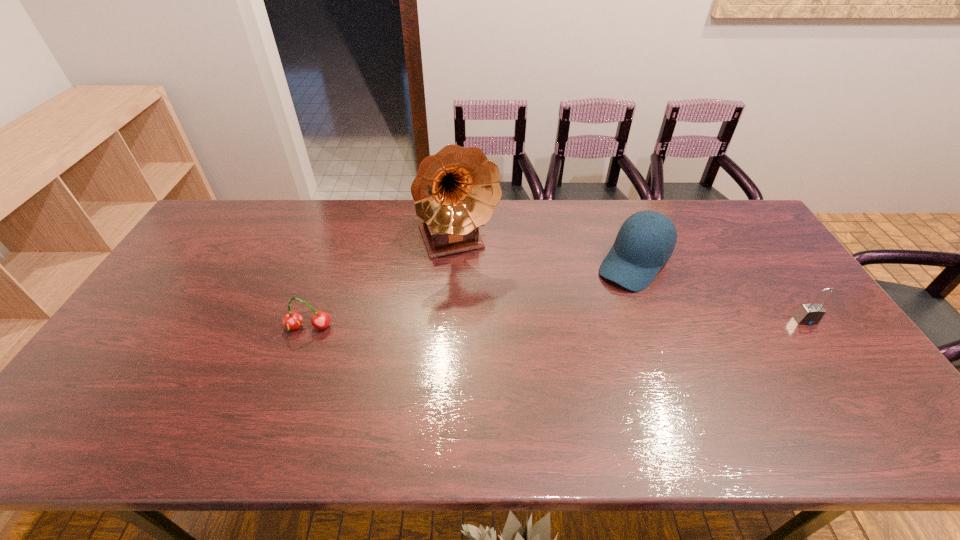
The width and height of the screenshot is (960, 540). I want to click on free area in between the leftmost object and the tallest object, so click(x=383, y=285).

At what (x,y) coordinates should I click in order to perform the action: click on vacant space that is in between the leftmost object and the padlock. Please return your answer as a coordinate pair (x, y). The height and width of the screenshot is (540, 960). Looking at the image, I should click on (557, 324).

Identify which object is located as the third nearest to the leftmost object. Please provide its 2D coordinates. Your answer should be formatted as a tuple, i.e. [(x, y)], where the tuple contains the x and y coordinates of a point satisfying the conditions above.

[(808, 314)]

Locate an element on the screen. The image size is (960, 540). object identified as the third closest to the leftmost object is located at coordinates (808, 314).